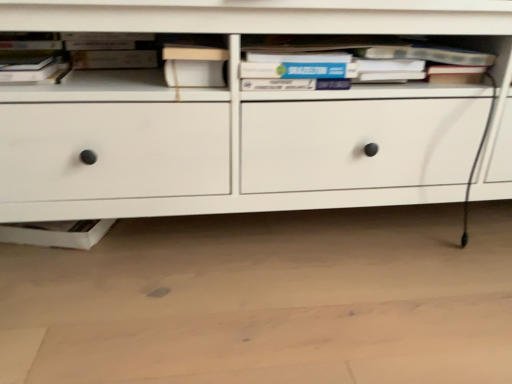
Question: Would you say white matte chest of drawers at center is inside or outside hardcover book at upper left, the 2th book in the right-to-left sequence?

Choices:
 (A) inside
 (B) outside

Answer: (B)

Question: In terms of width, does white matte chest of drawers at center look wider or thinner when compared to hardcover book at upper left, which is the first book in left-to-right order?

Choices:
 (A) thin
 (B) wide

Answer: (B)

Question: Which object is positioned closest to the hardcover book at center, which ranks as the 1th book in right-to-left order?

Choices:
 (A) matte black book at upper left
 (B) white matte chest of drawers at center
 (C) hardcover book at upper left, the 2th book in the right-to-left sequence

Answer: (B)

Question: Based on their relative distances, which object is farther from the hardcover book at center, which ranks as the 1th book in right-to-left order?

Choices:
 (A) white matte chest of drawers at center
 (B) matte black book at upper left
 (C) hardcover book at upper left, the 2th book in the right-to-left sequence

Answer: (C)